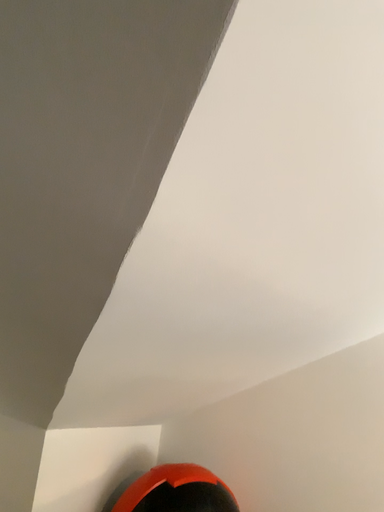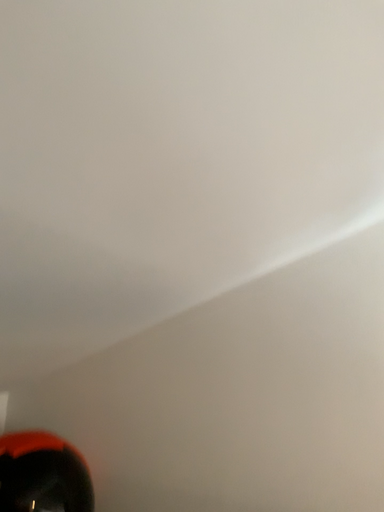
Question: How did the camera likely rotate when shooting the video?

Choices:
 (A) rotated left
 (B) rotated right

Answer: (B)